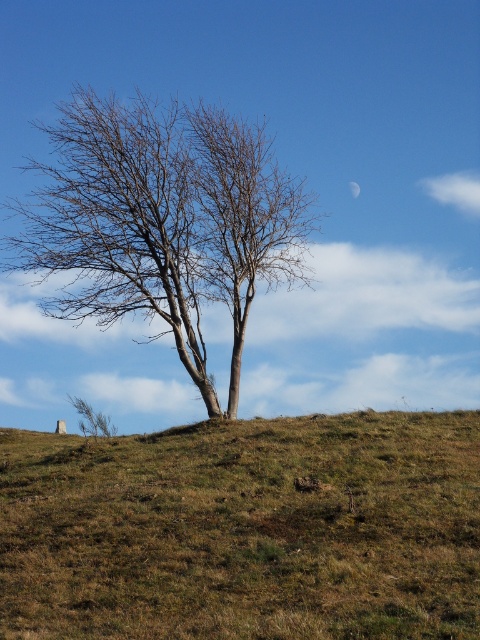
Question: Does brown grassy hillside at center have a smaller size compared to bare wood tree at center?

Choices:
 (A) yes
 (B) no

Answer: (A)

Question: Estimate the real-world distances between objects in this image. Which object is closer to the silver metallic moon at upper center?

Choices:
 (A) bare wood tree at center
 (B) brown grassy hillside at center

Answer: (A)

Question: Does brown grassy hillside at center appear over silver metallic moon at upper center?

Choices:
 (A) no
 (B) yes

Answer: (A)

Question: Which point appears farthest from the camera in this image?

Choices:
 (A) (468, 589)
 (B) (52, 250)

Answer: (B)

Question: Does brown grassy hillside at center appear over silver metallic moon at upper center?

Choices:
 (A) no
 (B) yes

Answer: (A)

Question: Estimate the real-world distances between objects in this image. Which object is farther from the brown grassy hillside at center?

Choices:
 (A) bare wood tree at center
 (B) silver metallic moon at upper center

Answer: (B)